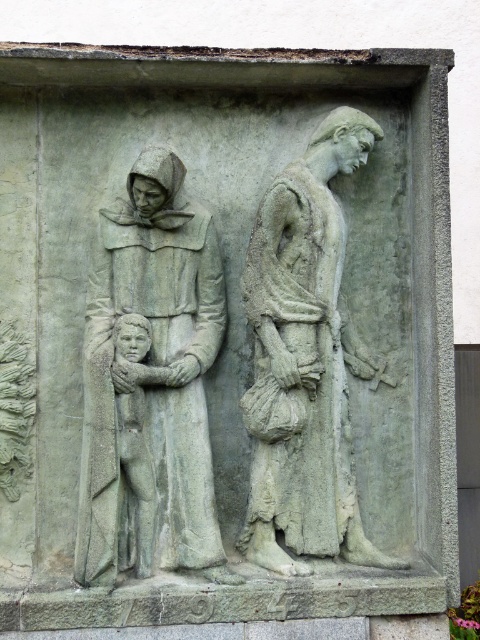
Question: Estimate the real-world distances between objects in this image. Which object is farther from the gray stone figure at center?

Choices:
 (A) gray stone child at center
 (B) gray stone figure at left

Answer: (A)

Question: Can you confirm if gray stone figure at center is positioned to the right of gray stone child at center?

Choices:
 (A) no
 (B) yes

Answer: (B)

Question: Does gray stone figure at left have a larger size compared to gray stone child at center?

Choices:
 (A) no
 (B) yes

Answer: (B)

Question: Does gray stone figure at left have a greater width compared to gray stone child at center?

Choices:
 (A) yes
 (B) no

Answer: (A)

Question: Which object is the farthest from the gray stone child at center?

Choices:
 (A) gray stone figure at center
 (B) gray stone figure at left

Answer: (A)

Question: Which of the following is the farthest from the observer?

Choices:
 (A) 300,451
 (B) 160,372

Answer: (A)